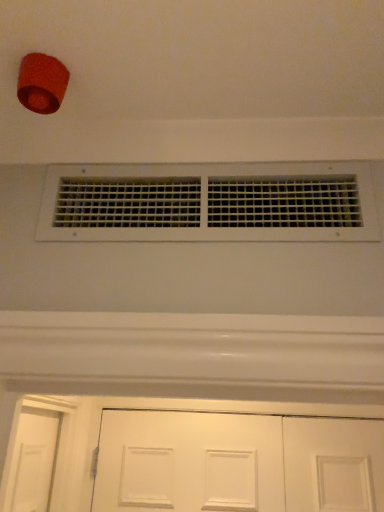
Question: Considering the relative sizes of white plastic vents at center and white matte door at lower center in the image provided, is white plastic vents at center thinner than white matte door at lower center?

Choices:
 (A) yes
 (B) no

Answer: (A)

Question: Is white plastic vents at center far away from white matte door at lower center?

Choices:
 (A) yes
 (B) no

Answer: (A)

Question: From a real-world perspective, is white plastic vents at center physically below white matte door at lower center?

Choices:
 (A) yes
 (B) no

Answer: (B)

Question: Considering the relative sizes of white plastic vents at center and white matte door at lower center in the image provided, is white plastic vents at center smaller than white matte door at lower center?

Choices:
 (A) no
 (B) yes

Answer: (B)

Question: Is white plastic vents at center turned away from white matte door at lower center?

Choices:
 (A) no
 (B) yes

Answer: (A)

Question: Is white plastic vents at center outside of white matte door at lower center?

Choices:
 (A) no
 (B) yes

Answer: (B)

Question: Is white matte door at lower center outside white plastic vents at center?

Choices:
 (A) no
 (B) yes

Answer: (B)

Question: Considering the relative sizes of white matte door at lower center and white plastic vents at center in the image provided, is white matte door at lower center smaller than white plastic vents at center?

Choices:
 (A) no
 (B) yes

Answer: (A)

Question: Considering the relative sizes of white matte door at lower center and white plastic vents at center in the image provided, is white matte door at lower center taller than white plastic vents at center?

Choices:
 (A) no
 (B) yes

Answer: (B)

Question: Can you confirm if white matte door at lower center is positioned to the left of white plastic vents at center?

Choices:
 (A) yes
 (B) no

Answer: (B)

Question: From the image's perspective, does white matte door at lower center appear lower than white plastic vents at center?

Choices:
 (A) no
 (B) yes

Answer: (B)

Question: Does white matte door at lower center have a lesser height compared to white plastic vents at center?

Choices:
 (A) no
 (B) yes

Answer: (A)

Question: Does point (203, 494) appear closer or farther from the camera than point (56, 224)?

Choices:
 (A) farther
 (B) closer

Answer: (A)